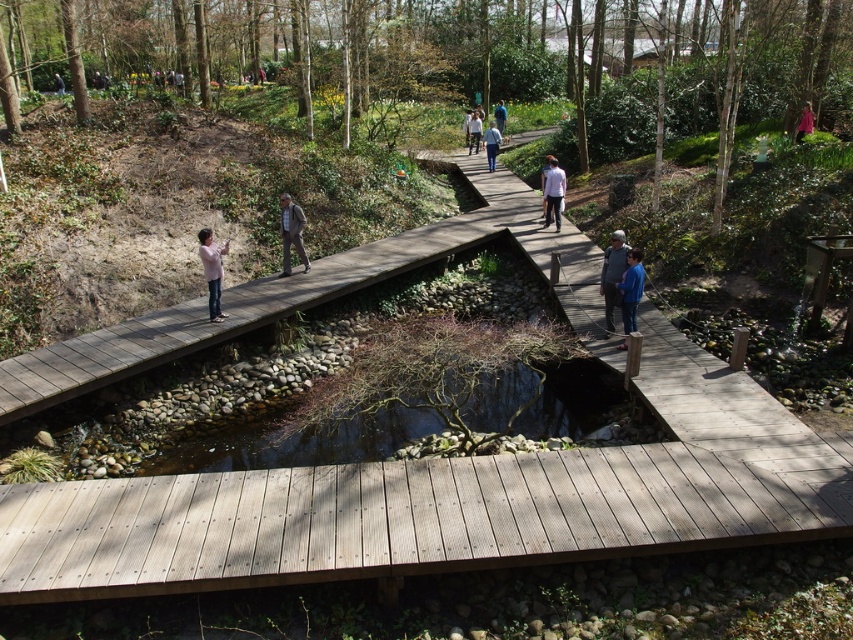
Question: Which object is positioned closest to the pink fabric at upper right?

Choices:
 (A) blue fabric jacket at center
 (B) natural wood bridge at center

Answer: (A)

Question: Which of the following is the closest to the observer?

Choices:
 (A) blue denim jeans at center
 (B) natural wood bridge at center
 (C) white matte shirt at center
 (D) light blue shirt at center

Answer: (B)

Question: In this image, where is pink fabric at center located relative to blue denim jacket at center?

Choices:
 (A) right
 (B) left

Answer: (B)

Question: Does clear water at center have a greater width compared to blue denim jacket at center?

Choices:
 (A) no
 (B) yes

Answer: (B)

Question: Can you confirm if blue denim jacket at center is positioned to the right of white cotton shirt at center?

Choices:
 (A) no
 (B) yes

Answer: (B)

Question: Which point is farther to the camera?

Choices:
 (A) (469, 122)
 (B) (61, 77)
 (C) (637, 257)
 (D) (810, 115)

Answer: (B)